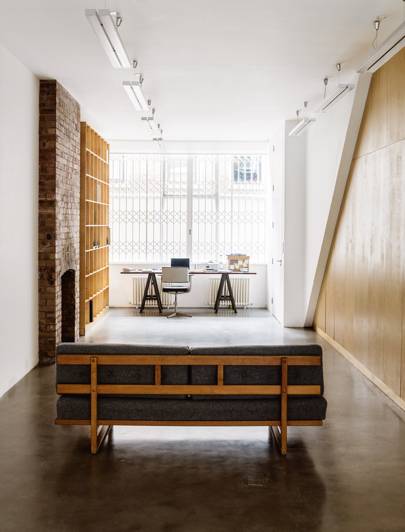
Locate an element on the screen. This screenshot has height=532, width=405. windows is located at coordinates (175, 215).